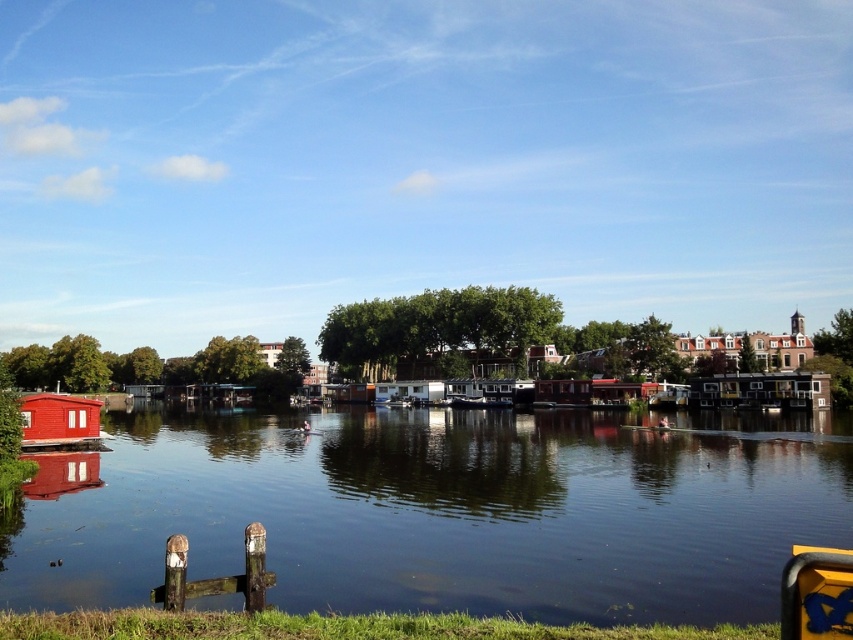
Which is behind, point (840, 456) or point (84, 410)?

The point (84, 410) is behind.

Is point (720, 509) positioned in front of point (68, 408)?

Yes, point (720, 509) is closer to viewer.

Image resolution: width=853 pixels, height=640 pixels. In order to click on smooth water at center in this screenshot , I will do `click(445, 509)`.

The image size is (853, 640). I want to click on smooth water at center, so click(x=445, y=509).